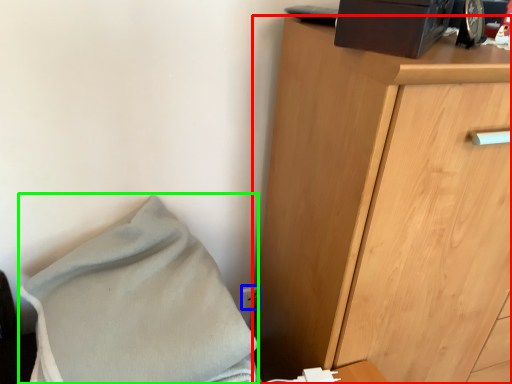
Question: Considering the real-world distances, which object is closest to chest of drawers (highlighted by a red box)? electric outlet (highlighted by a blue box) or blanket (highlighted by a green box).

Choices:
 (A) electric outlet
 (B) blanket

Answer: (B)